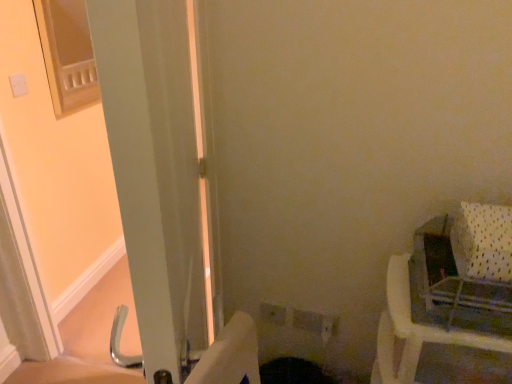
Question: From the image's perspective, is white plastic baby carriage at right above white glossy screen door at left?

Choices:
 (A) yes
 (B) no

Answer: (A)

Question: Is white plastic baby carriage at right looking in the opposite direction of white glossy screen door at left?

Choices:
 (A) yes
 (B) no

Answer: (B)

Question: Considering the relative sizes of white plastic baby carriage at right and white glossy screen door at left in the image provided, is white plastic baby carriage at right thinner than white glossy screen door at left?

Choices:
 (A) yes
 (B) no

Answer: (B)

Question: Is white plastic baby carriage at right to the right of white glossy screen door at left from the viewer's perspective?

Choices:
 (A) yes
 (B) no

Answer: (A)

Question: Is white plastic baby carriage at right positioned before white glossy screen door at left?

Choices:
 (A) no
 (B) yes

Answer: (A)

Question: Considering their positions, is white plastic baby carriage at right located in front of or behind white plastic chair at right?

Choices:
 (A) behind
 (B) front

Answer: (B)

Question: Is white plastic baby carriage at right to the left or to the right of white plastic chair at right in the image?

Choices:
 (A) left
 (B) right

Answer: (A)

Question: From a real-world perspective, relative to white plastic chair at right, is white plastic baby carriage at right vertically above or below?

Choices:
 (A) below
 (B) above

Answer: (B)

Question: Considering the positions of white plastic baby carriage at right and white plastic chair at right in the image, is white plastic baby carriage at right wider or thinner than white plastic chair at right?

Choices:
 (A) wide
 (B) thin

Answer: (B)

Question: In the image, is white glossy screen door at left positioned in front of or behind white plastic chair at right?

Choices:
 (A) behind
 (B) front

Answer: (B)

Question: From the image's perspective, is white glossy screen door at left positioned above or below white plastic chair at right?

Choices:
 (A) below
 (B) above

Answer: (B)

Question: Is point (189, 296) positioned closer to the camera than point (415, 347)?

Choices:
 (A) farther
 (B) closer

Answer: (A)

Question: In terms of size, does white glossy screen door at left appear bigger or smaller than white plastic chair at right?

Choices:
 (A) small
 (B) big

Answer: (B)

Question: Do you think white glossy screen door at left is within white plastic baby carriage at right, or outside of it?

Choices:
 (A) outside
 (B) inside

Answer: (A)

Question: From a real-world perspective, is white glossy screen door at left positioned above or below white plastic baby carriage at right?

Choices:
 (A) below
 (B) above

Answer: (A)